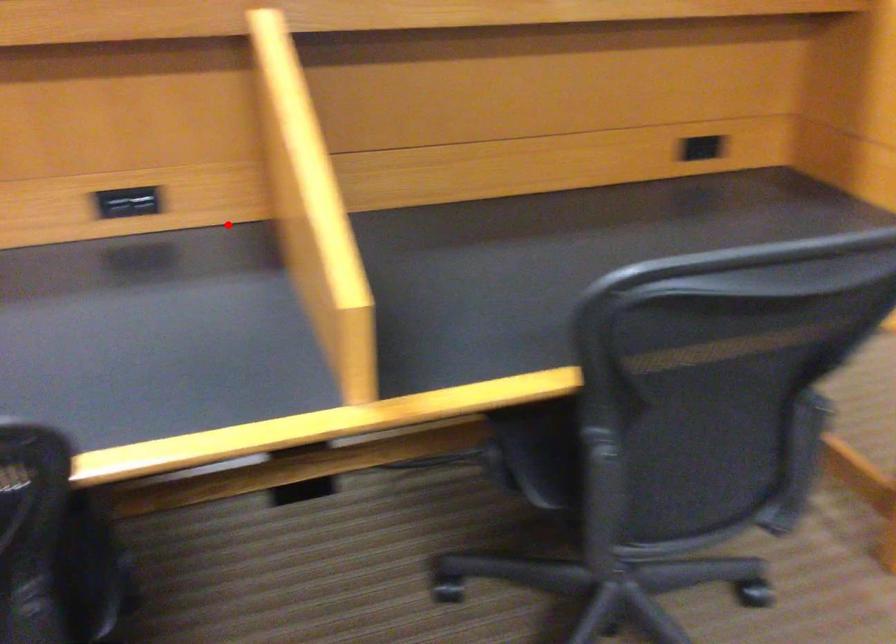
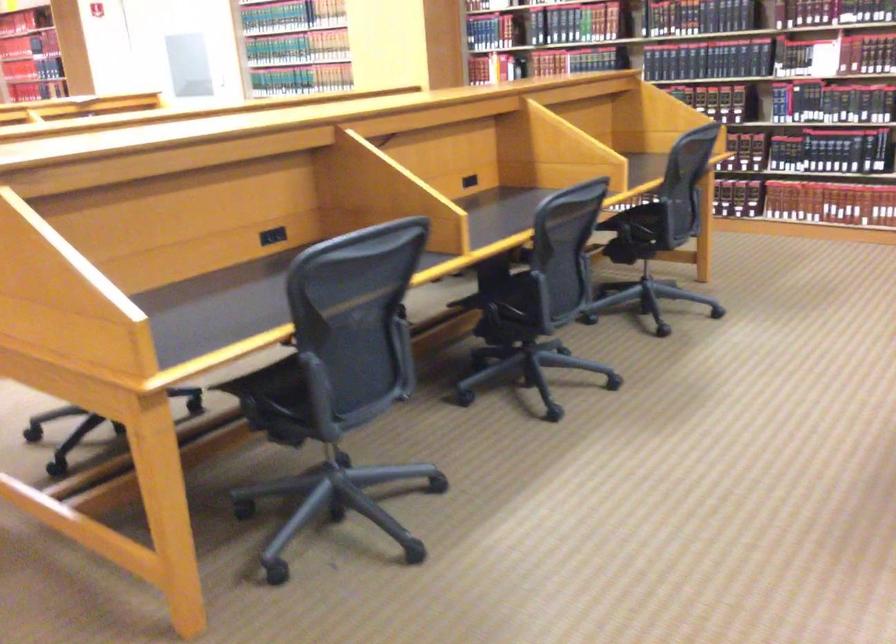
The point at the highlighted location is marked in the first image. Where is the corresponding point in the second image?

(469, 181)